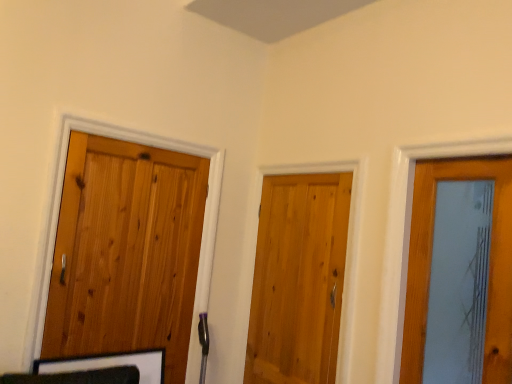
Question: From a real-world perspective, is natural wood door at center, the second door viewed from the left, physically above natural wood door at left, the 2th door viewed from the right?

Choices:
 (A) yes
 (B) no

Answer: (B)

Question: From a real-world perspective, is natural wood door at center, the first door positioned from the right, physically below natural wood door at left, the 1th door in the left-to-right sequence?

Choices:
 (A) yes
 (B) no

Answer: (A)

Question: From the image's perspective, does natural wood door at center, the first door positioned from the right, appear higher than natural wood door at left, the 2th door viewed from the right?

Choices:
 (A) no
 (B) yes

Answer: (A)

Question: Is the depth of natural wood door at center, the second door viewed from the left, greater than that of natural wood door at left, the 1th door in the left-to-right sequence?

Choices:
 (A) yes
 (B) no

Answer: (A)

Question: Considering the relative sizes of natural wood door at center, the first door positioned from the right, and natural wood door at left, the 1th door in the left-to-right sequence, in the image provided, is natural wood door at center, the first door positioned from the right, bigger than natural wood door at left, the 1th door in the left-to-right sequence,?

Choices:
 (A) yes
 (B) no

Answer: (B)

Question: Is natural wood door at center, the second door viewed from the left, located outside natural wood door at left, the 2th door viewed from the right?

Choices:
 (A) yes
 (B) no

Answer: (A)

Question: From a real-world perspective, is natural wood door at left, the 2th door viewed from the right, positioned over natural wood door at center, the second door viewed from the left, based on gravity?

Choices:
 (A) no
 (B) yes

Answer: (B)

Question: Would you say natural wood door at left, the 1th door in the left-to-right sequence, is outside natural wood door at center, the second door viewed from the left?

Choices:
 (A) no
 (B) yes

Answer: (B)

Question: From the image's perspective, is natural wood door at left, the 2th door viewed from the right, under natural wood door at center, the first door positioned from the right?

Choices:
 (A) no
 (B) yes

Answer: (A)

Question: Is natural wood door at left, the 2th door viewed from the right, to the left of natural wood door at center, the first door positioned from the right, from the viewer's perspective?

Choices:
 (A) no
 (B) yes

Answer: (B)

Question: From the image's perspective, is natural wood door at left, the 1th door in the left-to-right sequence, on natural wood door at center, the first door positioned from the right?

Choices:
 (A) no
 (B) yes

Answer: (B)

Question: Does natural wood door at left, the 1th door in the left-to-right sequence, have a smaller size compared to natural wood door at center, the first door positioned from the right?

Choices:
 (A) no
 (B) yes

Answer: (A)

Question: Relative to natural wood door at left, the 2th door viewed from the right, is natural wood door at center, the second door viewed from the left, in front or behind?

Choices:
 (A) front
 (B) behind

Answer: (B)